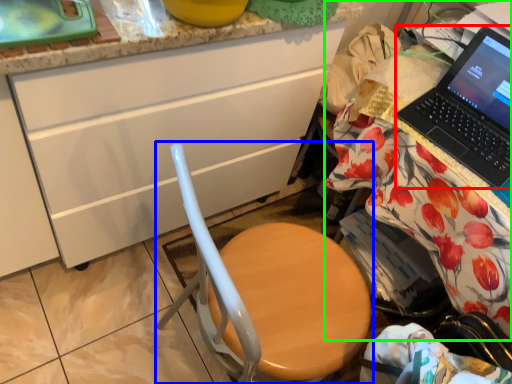
Question: Based on their relative distances, which object is farther from laptop (highlighted by a red box)? Choose from chair (highlighted by a blue box) and desk (highlighted by a green box).

Choices:
 (A) chair
 (B) desk

Answer: (A)